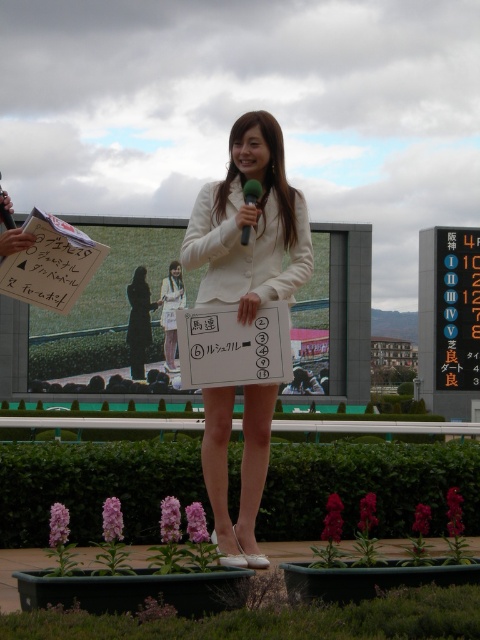
Question: Which point is farther from the camera taking this photo?

Choices:
 (A) (249, 449)
 (B) (181, 285)
 (C) (163, 314)

Answer: (B)

Question: Considering the relative positions of black plastic sign at center right and black matte dress at center in the image provided, where is black plastic sign at center right located with respect to black matte dress at center?

Choices:
 (A) left
 (B) right

Answer: (B)

Question: Can you confirm if black plastic sign at center right is wider than metallic silver microphone at center?

Choices:
 (A) yes
 (B) no

Answer: (A)

Question: Is white paper at center thinner than white satin dress at center?

Choices:
 (A) no
 (B) yes

Answer: (B)

Question: Considering the real-world distances, which object is closest to the white satin dress at center?

Choices:
 (A) black plastic sign at center right
 (B) white fabric dress at center
 (C) black matte dress at center
 (D) white paper at center

Answer: (B)

Question: Which of the following is the farthest from the observer?

Choices:
 (A) black plastic sign at center right
 (B) white paper at center

Answer: (A)